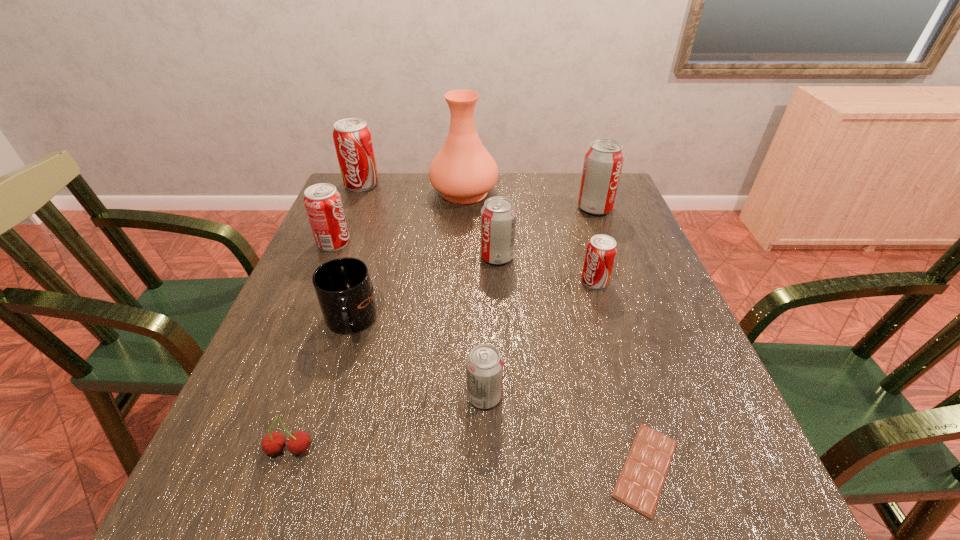
Locate an element on the screen. The height and width of the screenshot is (540, 960). object located at the far left corner is located at coordinates (352, 137).

The width and height of the screenshot is (960, 540). What are the coordinates of `object that is positioned at the far right corner` in the screenshot? It's located at (603, 162).

Find the location of a particular element. object that is positioned at the near right corner is located at coordinates (639, 486).

In the image, there is a desktop. Identify the location of vacant space at the far edge. (542, 185).

Where is `vacant space at the near edge of the desktop`? vacant space at the near edge of the desktop is located at coordinates pos(537,534).

Identify the location of free space at the left edge. (323, 343).

Locate an element on the screen. The width and height of the screenshot is (960, 540). vacant region at the right edge of the desktop is located at coordinates (641, 235).

Where is `vacant area at the far left corner of the desktop`? vacant area at the far left corner of the desktop is located at coordinates (380, 185).

Identify the location of vacant area between the vase and the fourth nearest object. This screenshot has width=960, height=540. (407, 257).

You are a GUI agent. You are given a task and a screenshot of the screen. Output one action in this format:
    pyautogui.click(x=<x>, y=<y>)
    Task: Click on the free area in between the second biggest gray soda can and the second farthest red soda can
    The width and height of the screenshot is (960, 540).
    Given the screenshot: What is the action you would take?
    pyautogui.click(x=416, y=250)